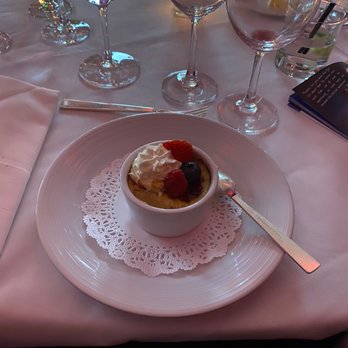
The height and width of the screenshot is (348, 348). In order to click on doily in this screenshot , I will do `click(153, 244)`.